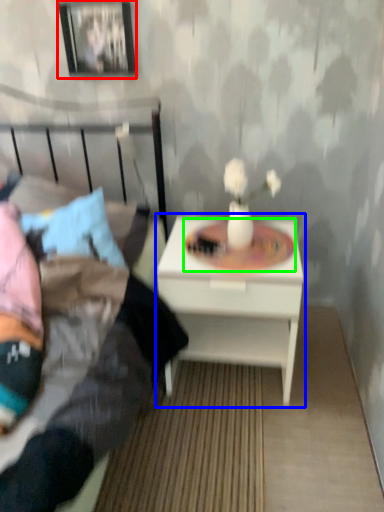
Question: Estimate the real-world distances between objects in this image. Which object is closer to picture frame (highlighted by a red box), nightstand (highlighted by a blue box) or round table (highlighted by a green box)?

Choices:
 (A) nightstand
 (B) round table

Answer: (B)